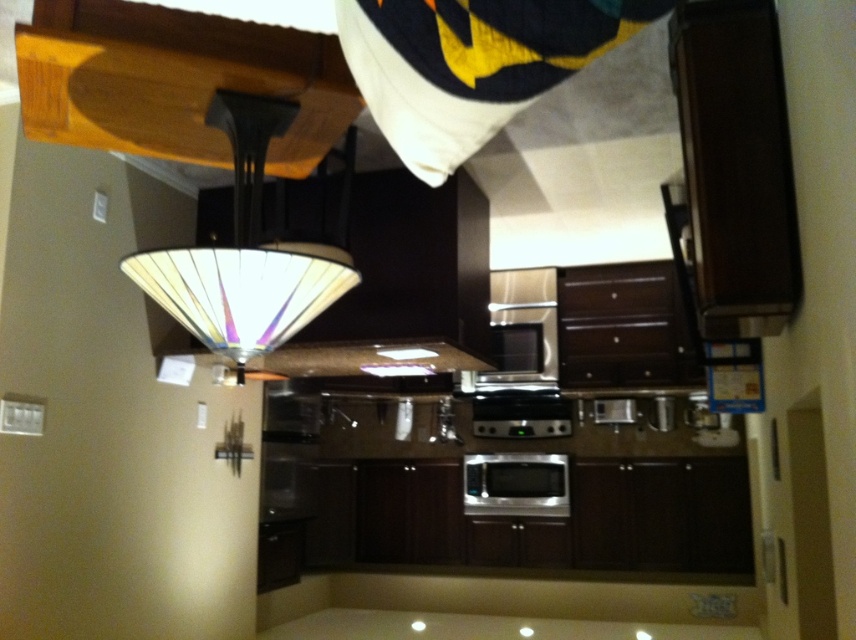
Question: Which point appears closest to the camera in this image?

Choices:
 (A) (490, 468)
 (B) (268, 273)

Answer: (B)

Question: Which object appears farthest from the camera in this image?

Choices:
 (A) translucent glass lampshade at upper center
 (B) satin silver oven at center

Answer: (B)

Question: Among these points, which one is nearest to the camera?

Choices:
 (A) (489, 476)
 (B) (283, 280)

Answer: (B)

Question: Is the position of translucent glass lampshade at upper center less distant than that of satin silver oven at center?

Choices:
 (A) yes
 (B) no

Answer: (A)

Question: Can you confirm if translucent glass lampshade at upper center is positioned to the left of satin silver oven at center?

Choices:
 (A) no
 (B) yes

Answer: (B)

Question: Is translucent glass lampshade at upper center thinner than satin silver oven at center?

Choices:
 (A) yes
 (B) no

Answer: (A)